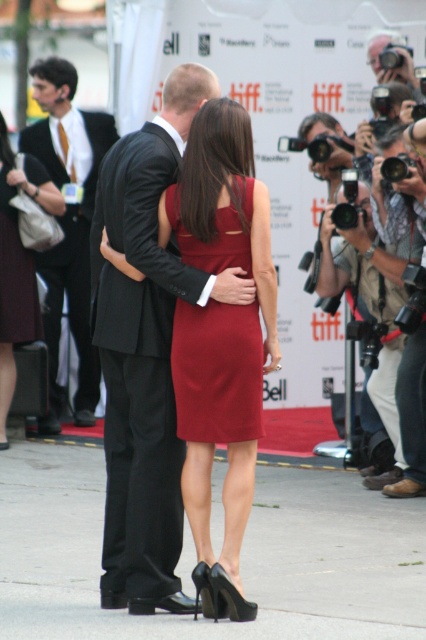
Between black satin suit at center and burgundy satin dress at center, which one is positioned higher?

burgundy satin dress at center is higher up.

Between black satin suit at center and burgundy satin dress at center, which one has more height?

With more height is black satin suit at center.

Does point (166, 424) lie in front of point (215, 264)?

No.

Find the location of a particular element. This screenshot has height=640, width=426. black satin suit at center is located at coordinates (140, 374).

Between burgundy satin dress at center and matte black suit at center, which one is positioned higher?

matte black suit at center is above.

Who is positioned more to the right, burgundy satin dress at center or matte black suit at center?

From the viewer's perspective, burgundy satin dress at center appears more on the right side.

Which is in front, point (178, 396) or point (74, 336)?

Point (178, 396)

I want to click on burgundy satin dress at center, so click(216, 371).

Who is positioned more to the left, satin red dress at center or matte burgundy dress at left?

From the viewer's perspective, matte burgundy dress at left appears more on the left side.

Can you confirm if satin red dress at center is positioned below matte burgundy dress at left?

Correct, satin red dress at center is located below matte burgundy dress at left.

The height and width of the screenshot is (640, 426). What are the coordinates of `satin red dress at center` in the screenshot? It's located at (221, 337).

Find the location of a particular element. The image size is (426, 640). satin red dress at center is located at coordinates (221, 337).